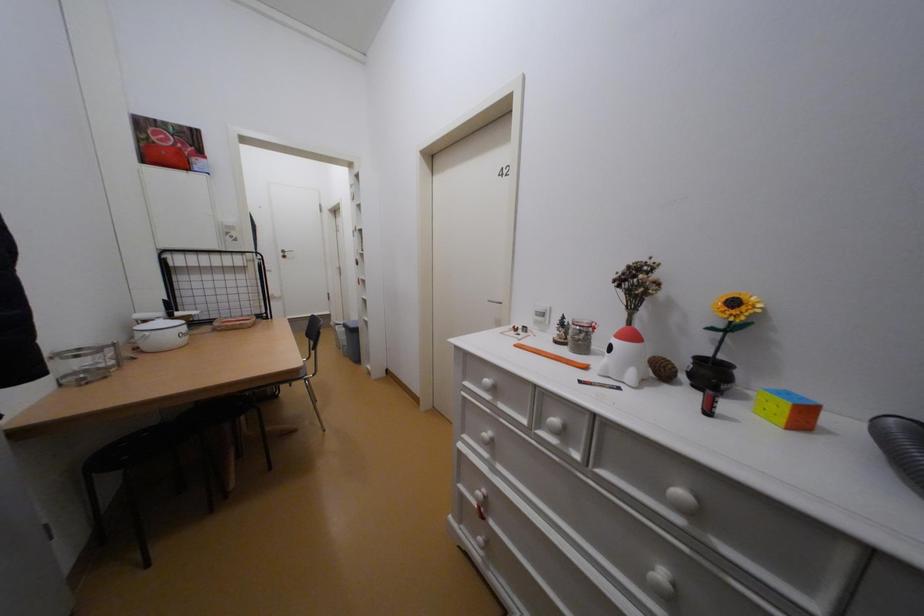
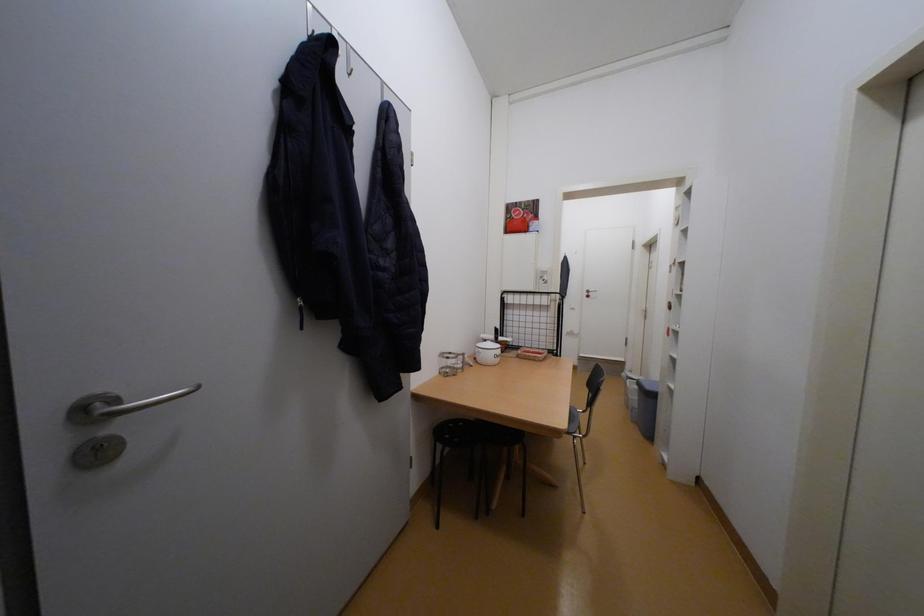
Question: The images are taken continuously from a first-person perspective. In which direction is your viewpoint rotating?

Choices:
 (A) Left
 (B) Right
 (C) Up
 (D) Down

Answer: (A)